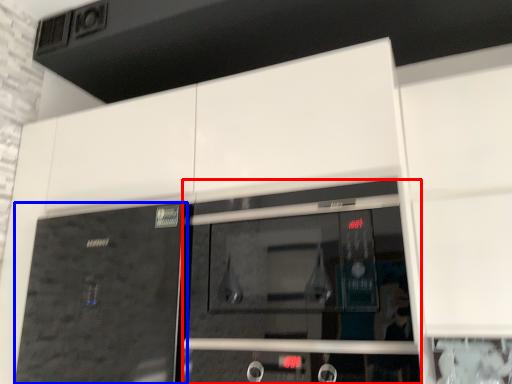
Question: Which object appears farthest to the camera in this image, screen door (highlighted by a red box) or door (highlighted by a blue box)?

Choices:
 (A) screen door
 (B) door

Answer: (B)